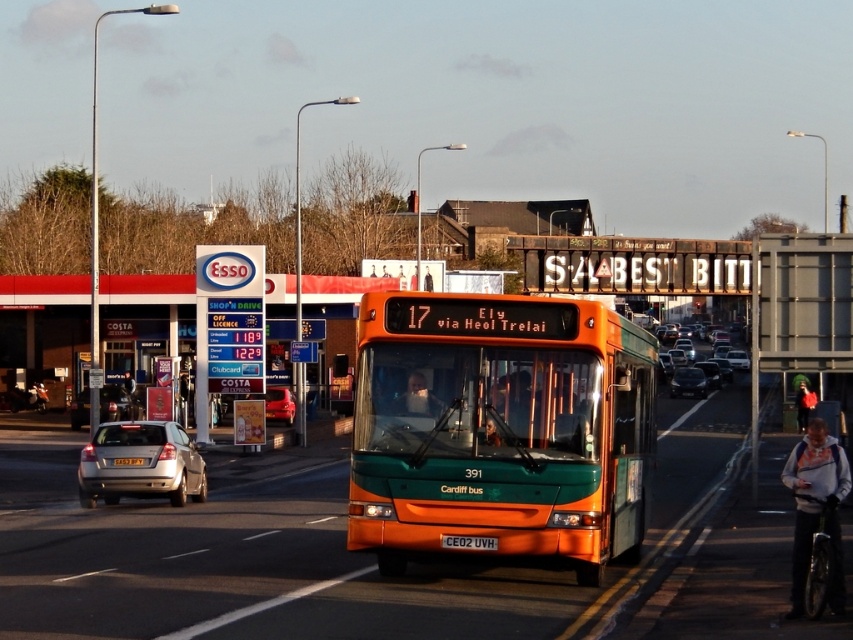
You are a pedestrian standing at the crosswalk and see the metallic red car at center and the orange metallic license plate at center. Which one is closer to the ground?

The metallic red car at center is closer to the ground than the orange metallic license plate at center.

You are a delivery driver who needs to park your car in the parking lot behind the Esso gas station. The parking lot has a single entrance on the right side of the road. Can you safely navigate your car around the metallic orange bus at center to reach the entrance?

The metallic orange bus at center is located at point (155, 323), so you can safely navigate around it to reach the entrance as long as you maintain a safe distance and follow traffic rules.